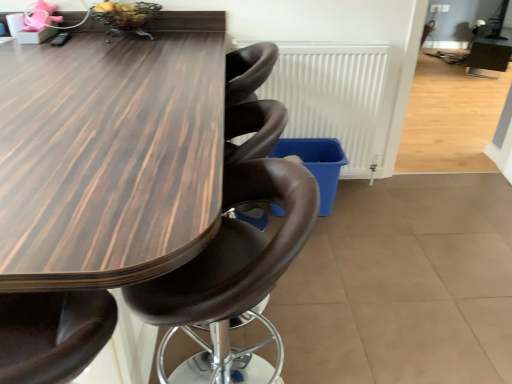
This screenshot has width=512, height=384. I want to click on brown leather chair at center, so click(x=234, y=251).

The image size is (512, 384). In order to click on wooden table at center in this screenshot , I will do `click(110, 155)`.

Locate an element on the screen. brown leather chair at center is located at coordinates (234, 251).

Which object is further away from the camera taking this photo, white matte radiator at center or wooden table at center?

white matte radiator at center is behind.

From the image's perspective, which object appears higher, white matte radiator at center or wooden table at center?

From the image's view, white matte radiator at center is above.

From a real-world perspective, who is located lower, white matte radiator at center or wooden table at center?

wooden table at center, from a real-world perspective.

I want to click on radiator on the right side of wooden table at center, so click(x=336, y=97).

Is wooden table at center facing towards brown leather chair at center?

No.

How different are the orientations of wooden table at center and brown leather chair at center in degrees?

There is a 3.6-degree angle between the facing directions of wooden table at center and brown leather chair at center.

From the image's perspective, is wooden table at center over brown leather chair at center?

Yes, from the image's perspective, wooden table at center is over brown leather chair at center.

Does point (123, 122) come behind point (246, 299)?

Yes, it is.

From the image's perspective, is brown leather chair at center below white matte radiator at center?

Indeed, from the image's perspective, brown leather chair at center is shown beneath white matte radiator at center.

Considering the positions of points (251, 227) and (292, 85), is point (251, 227) farther from camera compared to point (292, 85)?

No, (251, 227) is closer to viewer.

Between brown leather chair at center and white matte radiator at center, which one appears on the left side from the viewer's perspective?

From the viewer's perspective, brown leather chair at center appears more on the left side.

Is brown leather chair at center next to white matte radiator at center?

No.

Which of these two, white matte radiator at center or brown leather chair at center, stands taller?

With more height is brown leather chair at center.

How distant is white matte radiator at center from brown leather chair at center?

white matte radiator at center and brown leather chair at center are 4.37 feet apart from each other.

Is white matte radiator at center oriented towards brown leather chair at center?

Yes, white matte radiator at center faces towards brown leather chair at center.

Does point (202, 19) come in front of point (297, 48)?

No, (202, 19) is further to viewer.

From a real-world perspective, who is located higher, wooden table at center or white matte radiator at center?

white matte radiator at center.

Where is `radiator positioned vertically above the wooden table at center (from a real-world perspective)`? The width and height of the screenshot is (512, 384). radiator positioned vertically above the wooden table at center (from a real-world perspective) is located at coordinates (336, 97).

Between brown leather chair at center and wooden table at center, which one is positioned in front?

wooden table at center.

Is brown leather chair at center inside the boundaries of wooden table at center, or outside?

brown leather chair at center exists entirely within wooden table at center.

From the image's perspective, which one is positioned higher, brown leather chair at center or wooden table at center?

wooden table at center appears higher in the image.

Considering the relative positions of brown leather chair at center and wooden table at center in the image provided, is brown leather chair at center to the left of wooden table at center from the viewer's perspective?

In fact, brown leather chair at center is to the right of wooden table at center.

Where is `table on the left of white matte radiator at center`? table on the left of white matte radiator at center is located at coordinates (110, 155).

Find the location of a particular element. The height and width of the screenshot is (384, 512). table lying in front of the brown leather chair at center is located at coordinates (110, 155).

Looking at the image, which one is located further to brown leather chair at center, wooden table at center or white matte radiator at center?

white matte radiator at center is further to brown leather chair at center.

Looking at the image, which one is located further to wooden table at center, white matte radiator at center or brown leather chair at center?

white matte radiator at center.

Estimate the real-world distances between objects in this image. Which object is further from white matte radiator at center, brown leather chair at center or wooden table at center?

brown leather chair at center.

Based on their spatial positions, is wooden table at center or brown leather chair at center closer to white matte radiator at center?

wooden table at center lies closer to white matte radiator at center than the other object.

Looking at the image, which one is located further to brown leather chair at center, white matte radiator at center or wooden table at center?

white matte radiator at center is positioned further to the anchor brown leather chair at center.

Estimate the real-world distances between objects in this image. Which object is further from wooden table at center, brown leather chair at center or white matte radiator at center?

white matte radiator at center.

Identify the location of chair between wooden table at center and white matte radiator at center in the front-back direction. click(x=234, y=251).